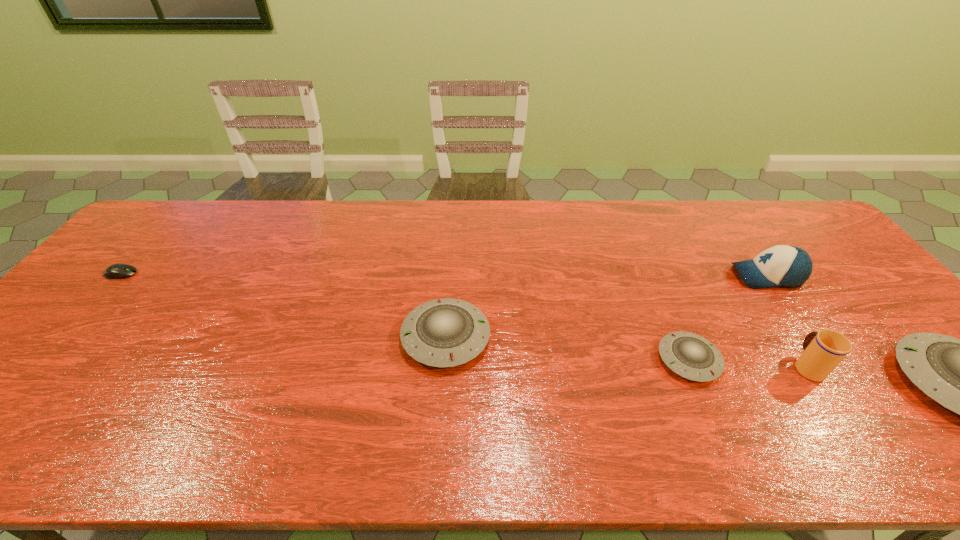
Given the evenly spaced saucers in the image, where should an extra saucer be added on the left to preserve the spacing? Please point to a vacant space. Please provide its 2D coordinates. Your answer should be formatted as a tuple, i.e. [(x, y)], where the tuple contains the x and y coordinates of a point satisfying the conditions above.

[(224, 316)]